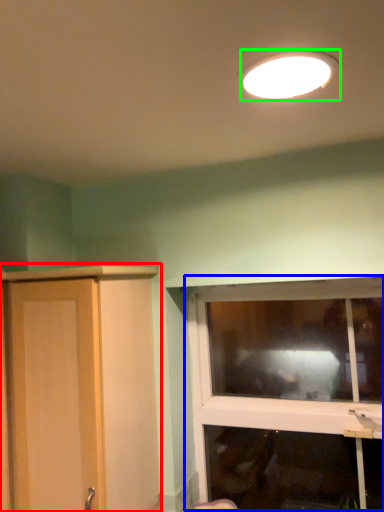
Question: Which object is the farthest from cupboard (highlighted by a red box)? Choose among these: window (highlighted by a blue box) or lamp (highlighted by a green box).

Choices:
 (A) window
 (B) lamp

Answer: (A)